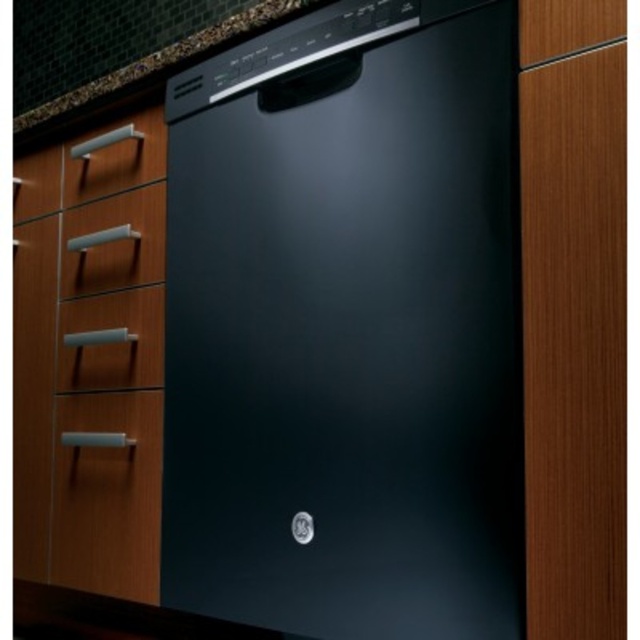
You are a kitchen designer planning to install a new appliance that requires a minimum of 10 inches of clearance between two adjacent drawers. You have two existing drawers in the kitchen scene described above. Can the satin nickel drawer at center and the satin silver drawer at left accommodate this appliance between them?

The distance between the satin nickel drawer at center and the satin silver drawer at left is 9.14 inches, which is less than the required 10 inches. Therefore, the appliance cannot be installed between them due to insufficient clearance.

From the picture: You are organizing the kitchen and need to place a new appliance between the black matte dishwasher at center and the matte silver drawer at lower left. Based on their positions, which side of the dishwasher should you place the appliance to ensure it aligns with the drawer?

The black matte dishwasher at center is to the right of the matte silver drawer at lower left, so placing the new appliance to the left side of the dishwasher would align it with the drawer.

You are standing in a modern kitchen and want to adjust the settings on the black matte dishwasher at center. If your arm can reach up to 30 inches, will you be able to comfortably reach the control panel?

The black matte dishwasher at center and camera are 30.15 inches apart from each other. Since your arm can only reach up to 30 inches, you will not be able to comfortably reach the control panel as it is slightly farther than your reach.